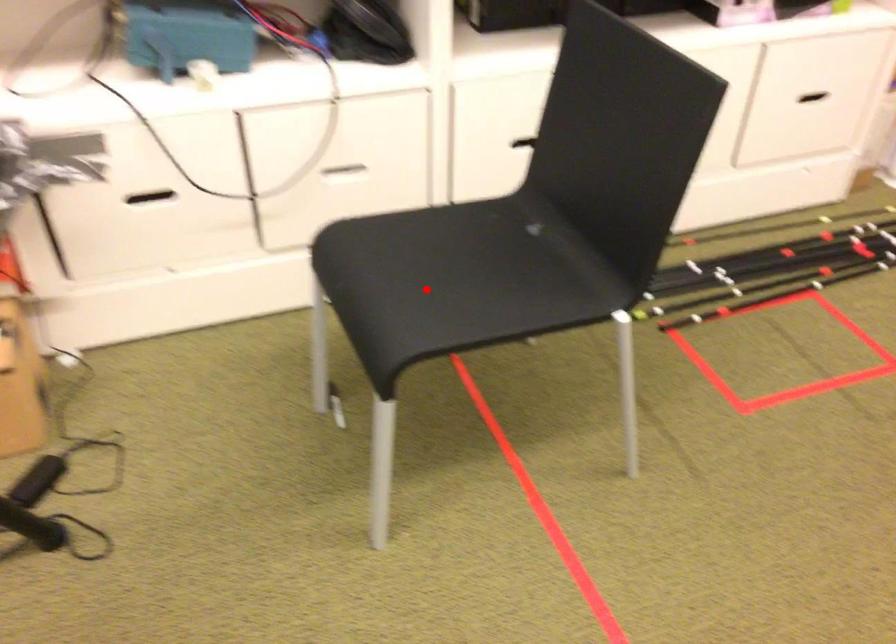
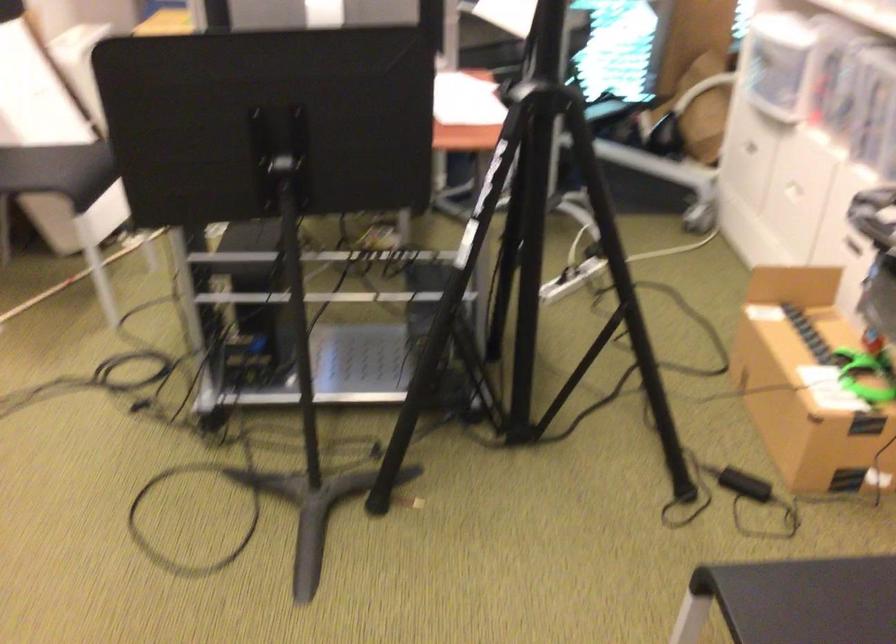
Question: I am providing you with two images of the same scene from different viewpoints. Image1 has a red point marked. In image2, the corresponding 3D location appears at what relative position? Reply with the corresponding letter.

Choices:
 (A) Closer
 (B) Farther

Answer: (A)